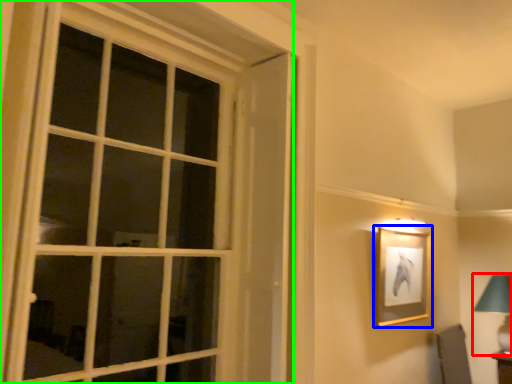
Question: Estimate the real-world distances between objects in this image. Which object is closer to bedside lamp (highlighted by a red box), picture frame (highlighted by a blue box) or window (highlighted by a green box)?

Choices:
 (A) picture frame
 (B) window

Answer: (A)